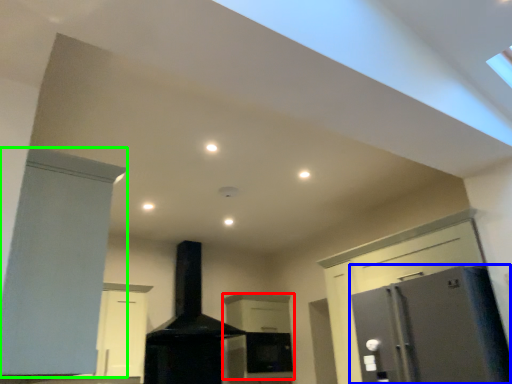
Question: Considering the real-world distances, which object is farthest from cabinetry (highlighted by a red box)? refrigerator (highlighted by a blue box) or cabinetry (highlighted by a green box)?

Choices:
 (A) refrigerator
 (B) cabinetry

Answer: (B)